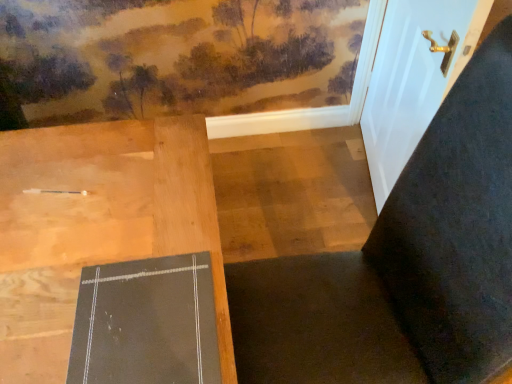
The image size is (512, 384). Find the location of `matte black bulletin board at center`. matte black bulletin board at center is located at coordinates (146, 323).

Between dark fabric chair at center and white glossy door at upper right, which one has more height?

dark fabric chair at center is taller.

Considering the relative positions of dark fabric chair at center and white glossy door at upper right in the image provided, is dark fabric chair at center to the right of white glossy door at upper right from the viewer's perspective?

No, dark fabric chair at center is not to the right of white glossy door at upper right.

Are dark fabric chair at center and white glossy door at upper right far apart?

dark fabric chair at center is actually quite close to white glossy door at upper right.

Can white glossy door at upper right be found inside dark fabric chair at center?

No, white glossy door at upper right is not a part of dark fabric chair at center.

Between white glossy door at upper right and matte black bulletin board at center, which one is positioned behind?

white glossy door at upper right is more distant.

Is the surface of white glossy door at upper right in direct contact with matte black bulletin board at center?

No, white glossy door at upper right is not next to matte black bulletin board at center.

Considering the relative sizes of white glossy door at upper right and matte black bulletin board at center in the image provided, is white glossy door at upper right thinner than matte black bulletin board at center?

Yes, white glossy door at upper right is thinner than matte black bulletin board at center.

Which object is more forward, matte black bulletin board at center or dark fabric chair at center?

dark fabric chair at center is closer to the camera.

Considering the points (194, 380) and (480, 147), which point is in front, point (194, 380) or point (480, 147)?

Positioned in front is point (194, 380).

Considering the sizes of objects matte black bulletin board at center and dark fabric chair at center in the image provided, who is shorter, matte black bulletin board at center or dark fabric chair at center?

matte black bulletin board at center is shorter.

Which is more to the right, matte black bulletin board at center or dark fabric chair at center?

Positioned to the right is dark fabric chair at center.

How different are the orientations of white glossy door at upper right and dark fabric chair at center in degrees?

The facing directions of white glossy door at upper right and dark fabric chair at center are 165 degrees apart.

Does white glossy door at upper right touch dark fabric chair at center?

There is a gap between white glossy door at upper right and dark fabric chair at center.

Is white glossy door at upper right at the right side of dark fabric chair at center?

Correct, you'll find white glossy door at upper right to the right of dark fabric chair at center.

From the image's perspective, which is below, white glossy door at upper right or dark fabric chair at center?

dark fabric chair at center.

Who is taller, matte black bulletin board at center or white glossy door at upper right?

white glossy door at upper right is taller.

Which of these two, matte black bulletin board at center or white glossy door at upper right, is thinner?

white glossy door at upper right.

Between point (214, 383) and point (437, 106), which one is positioned in front?

Point (214, 383)

Could you tell me if matte black bulletin board at center is turned towards white glossy door at upper right?

No, matte black bulletin board at center is not turned towards white glossy door at upper right.

Considering the relative sizes of dark fabric chair at center and matte black bulletin board at center in the image provided, is dark fabric chair at center shorter than matte black bulletin board at center?

No.

Locate an element on the screen. bulletin board located above the dark fabric chair at center (from a real-world perspective) is located at coordinates (146, 323).

The image size is (512, 384). In order to click on door above the dark fabric chair at center (from the image's perspective) in this screenshot , I will do point(413,79).

This screenshot has width=512, height=384. What are the coordinates of `bulletin board located on the left of white glossy door at upper right` in the screenshot? It's located at (146, 323).

Looking at the image, which one is located closer to white glossy door at upper right, dark fabric chair at center or matte black bulletin board at center?

Based on the image, dark fabric chair at center appears to be nearer to white glossy door at upper right.

Which object lies nearer to the anchor point matte black bulletin board at center, white glossy door at upper right or dark fabric chair at center?

dark fabric chair at center is positioned closer to the anchor matte black bulletin board at center.

Based on their spatial positions, is matte black bulletin board at center or white glossy door at upper right closer to dark fabric chair at center?

matte black bulletin board at center.

When comparing their distances from white glossy door at upper right, does matte black bulletin board at center or dark fabric chair at center seem further?

matte black bulletin board at center is further to white glossy door at upper right.

Estimate the real-world distances between objects in this image. Which object is further from matte black bulletin board at center, dark fabric chair at center or white glossy door at upper right?

Among the two, white glossy door at upper right is located further to matte black bulletin board at center.

Considering their positions, is white glossy door at upper right positioned further to dark fabric chair at center than matte black bulletin board at center?

white glossy door at upper right.

The height and width of the screenshot is (384, 512). Identify the location of bulletin board between white glossy door at upper right and dark fabric chair at center in the vertical direction. (146, 323).